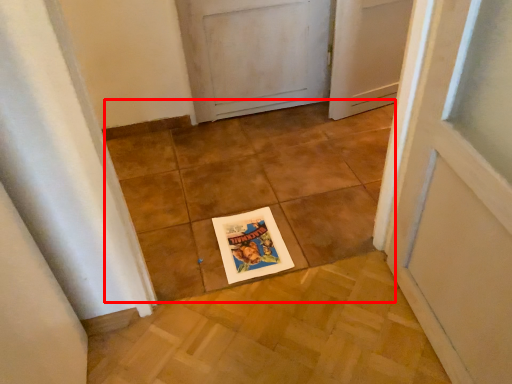
Question: Considering the relative positions of tile (annotated by the red box) and postcard in the image provided, where is tile (annotated by the red box) located with respect to the staircase?

Choices:
 (A) left
 (B) right

Answer: (B)